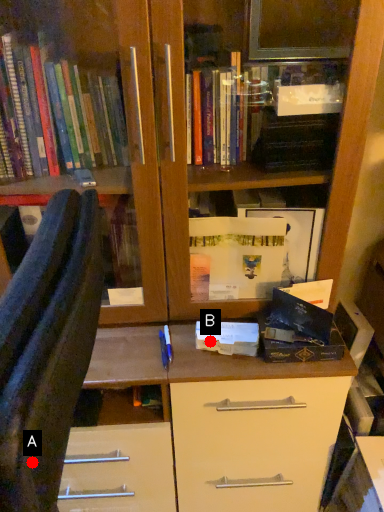
Question: Two points are circled on the image, labeled by A and B beside each circle. Which point is closer to the camera taking this photo?

Choices:
 (A) A is closer
 (B) B is closer

Answer: (A)